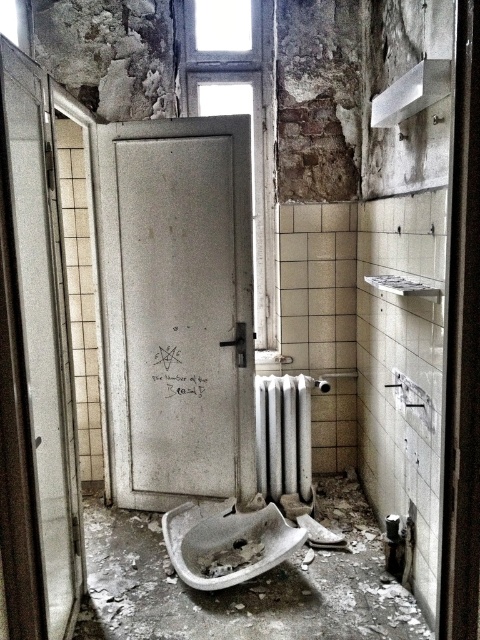
You are a plumber inspecting the bathroom and need to access the pipes behind the cracked porcelain sink at lower center and the white textured radiator at center. Which object is closer to the ground?

The cracked porcelain sink at lower center is shorter than the white textured radiator at center, so the cracked porcelain sink at lower center is closer to the ground.

You are a plumber inspecting the bathroom and need to access the white textured radiator at center. Is the cracked porcelain sink at lower center blocking your path to it?

The cracked porcelain sink at lower center is in front of the white textured radiator at center, so yes, the sink is blocking the path to the radiator.